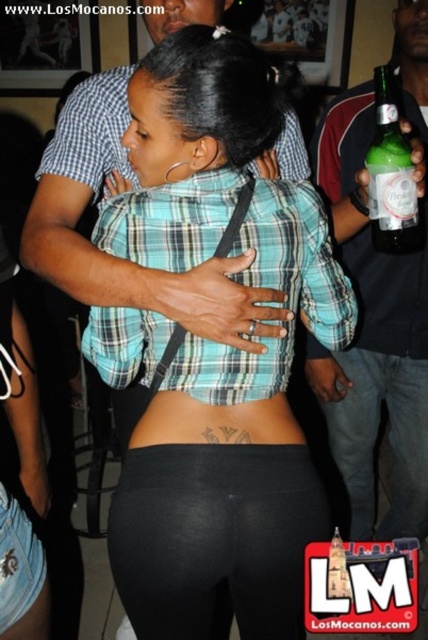
Question: Is matte plaid shirt at center above black matte jeans at lower center?

Choices:
 (A) yes
 (B) no

Answer: (A)

Question: Can you confirm if black matte leggings at lower center is bigger than green plaid shirt at center?

Choices:
 (A) yes
 (B) no

Answer: (B)

Question: Which of the following is the farthest from the observer?

Choices:
 (A) matte plaid shirt at center
 (B) black matte jeans at lower center
 (C) green glass bottle at upper right

Answer: (B)

Question: Is black matte jeans at lower center thinner than plaid fabric shirt at upper center?

Choices:
 (A) no
 (B) yes

Answer: (A)

Question: Which object is the closest to the black matte jeans at lower center?

Choices:
 (A) green glass bottle at right
 (B) black matte leggings at lower center

Answer: (A)

Question: Which point is farther to the camera?

Choices:
 (A) (309, 285)
 (B) (139, 438)

Answer: (A)